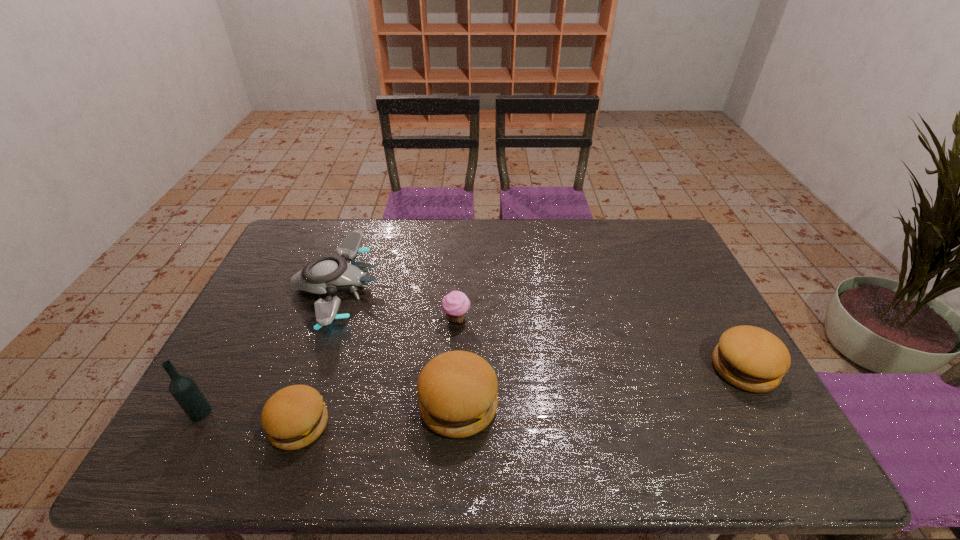
Where is `blank space located on the left of the second tallest hamburger`? The image size is (960, 540). blank space located on the left of the second tallest hamburger is located at coordinates (612, 368).

Find the location of a particular element. Image resolution: width=960 pixels, height=540 pixels. free spot located on the back of the cupcake is located at coordinates (460, 264).

I want to click on vacant space situated 0.210m on the front-facing side of the drone, so click(x=448, y=287).

You are a GUI agent. You are given a task and a screenshot of the screen. Output one action in this format:
    pyautogui.click(x=<x>, y=<y>)
    Task: Click on the vacant space situated on the right of the vodka
    
    Given the screenshot: What is the action you would take?
    pos(324,412)

Locate an element on the screen. The image size is (960, 540). object at the far edge is located at coordinates (326, 274).

The image size is (960, 540). Find the location of `vodka at the near edge`. vodka at the near edge is located at coordinates (183, 388).

The height and width of the screenshot is (540, 960). I want to click on drone that is at the left edge, so click(326, 274).

At what (x,y) coordinates should I click in order to perform the action: click on vodka situated at the left edge. Please return your answer as a coordinate pair (x, y). This screenshot has height=540, width=960. Looking at the image, I should click on (183, 388).

This screenshot has height=540, width=960. What are the coordinates of `object present at the right edge` in the screenshot? It's located at (750, 358).

This screenshot has height=540, width=960. I want to click on object that is at the far left corner, so click(x=326, y=274).